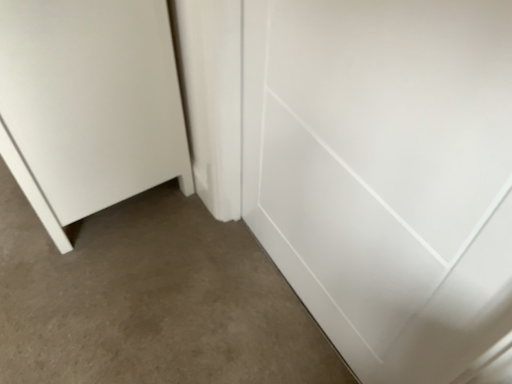
Question: Is white matte door at lower left, which is the second door from right to left, spatially inside white glossy door at center, acting as the 2th door starting from the left, or outside of it?

Choices:
 (A) inside
 (B) outside

Answer: (B)

Question: From a real-world perspective, relative to white glossy door at center, acting as the 2th door starting from the left, is white matte door at lower left, which is counted as the 1th door, starting from the left, vertically above or below?

Choices:
 (A) above
 (B) below

Answer: (B)

Question: Looking at their shapes, would you say white matte door at lower left, which is counted as the 1th door, starting from the left, is wider or thinner than white glossy door at center, which is the 1th door in right-to-left order?

Choices:
 (A) thin
 (B) wide

Answer: (B)

Question: Does point (439, 122) appear closer or farther from the camera than point (59, 9)?

Choices:
 (A) closer
 (B) farther

Answer: (A)

Question: Which is correct: white glossy door at center, which is the 1th door in right-to-left order, is inside white matte door at lower left, which is the second door from right to left, or outside of it?

Choices:
 (A) outside
 (B) inside

Answer: (A)

Question: Is white glossy door at center, which is the 1th door in right-to-left order, taller or shorter than white matte door at lower left, which is the second door from right to left?

Choices:
 (A) tall
 (B) short

Answer: (A)

Question: Considering their positions, is white glossy door at center, which is the 1th door in right-to-left order, located in front of or behind white matte door at lower left, which is counted as the 1th door, starting from the left?

Choices:
 (A) front
 (B) behind

Answer: (A)